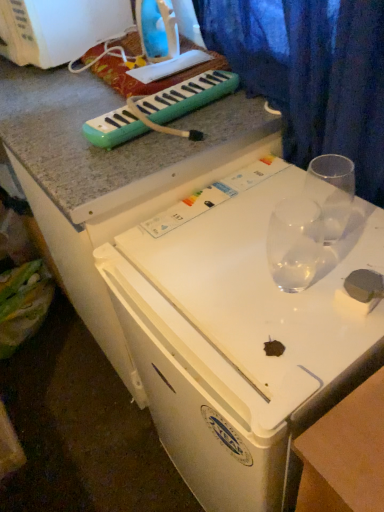
At what (x,y) coordinates should I click in order to perform the action: click on vacant area that is in front of clear glass martini glass at center, the 1th martini glass in the left-to-right sequence. Please return your answer as a coordinate pair (x, y). Image resolution: width=384 pixels, height=512 pixels. Looking at the image, I should click on (300, 339).